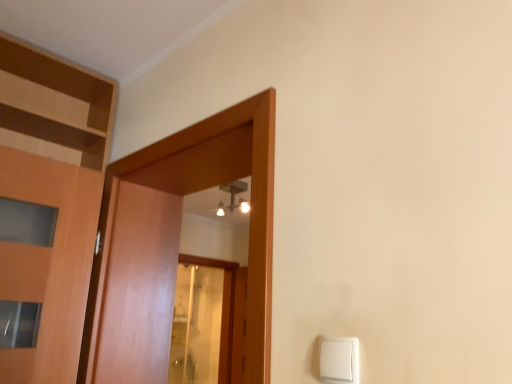
Question: From the image's perspective, is white plastic light switch at lower right positioned above or below wooden door at center?

Choices:
 (A) above
 (B) below

Answer: (B)

Question: In terms of size, does white plastic light switch at lower right appear bigger or smaller than wooden door at center?

Choices:
 (A) small
 (B) big

Answer: (A)

Question: Considering the positions of white plastic light switch at lower right and wooden door at center in the image, is white plastic light switch at lower right wider or thinner than wooden door at center?

Choices:
 (A) wide
 (B) thin

Answer: (B)

Question: Visually, is wooden door at center positioned to the left or to the right of white plastic light switch at lower right?

Choices:
 (A) left
 (B) right

Answer: (A)

Question: Is wooden door at center inside the boundaries of white plastic light switch at lower right, or outside?

Choices:
 (A) outside
 (B) inside

Answer: (A)

Question: From the image's perspective, is wooden door at center located above or below white plastic light switch at lower right?

Choices:
 (A) above
 (B) below

Answer: (A)

Question: From a real-world perspective, is wooden door at center physically located above or below white plastic light switch at lower right?

Choices:
 (A) above
 (B) below

Answer: (A)